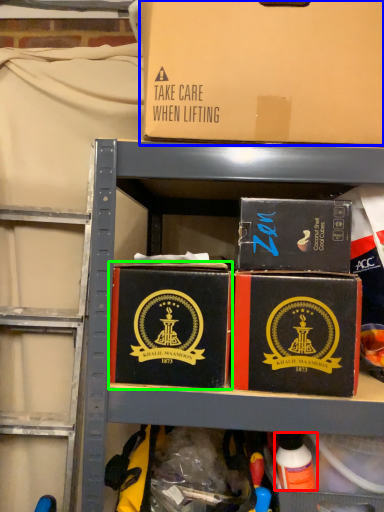
Question: Based on their relative distances, which object is farther from toy (highlighted by a red box)? Choose from box (highlighted by a blue box) and box (highlighted by a green box).

Choices:
 (A) box
 (B) box

Answer: (A)